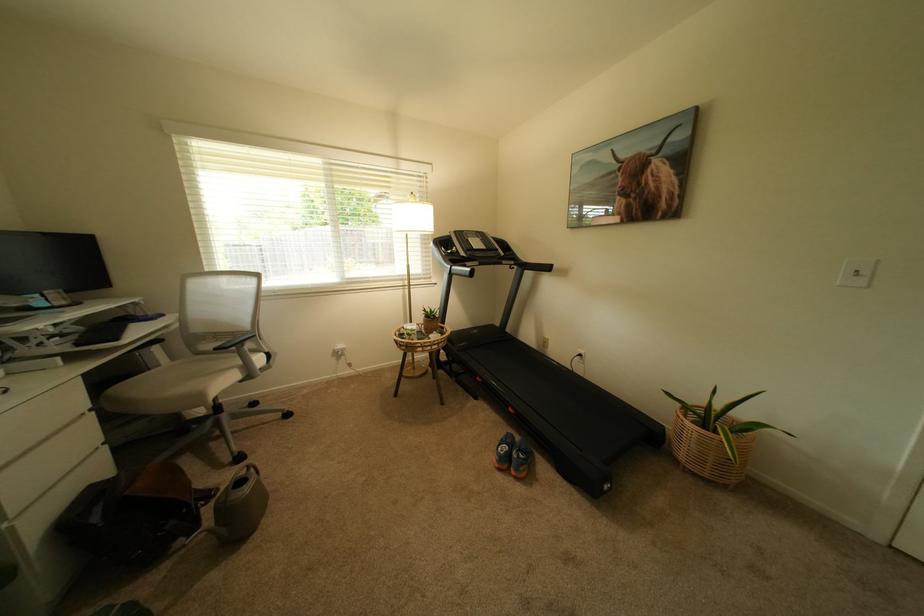
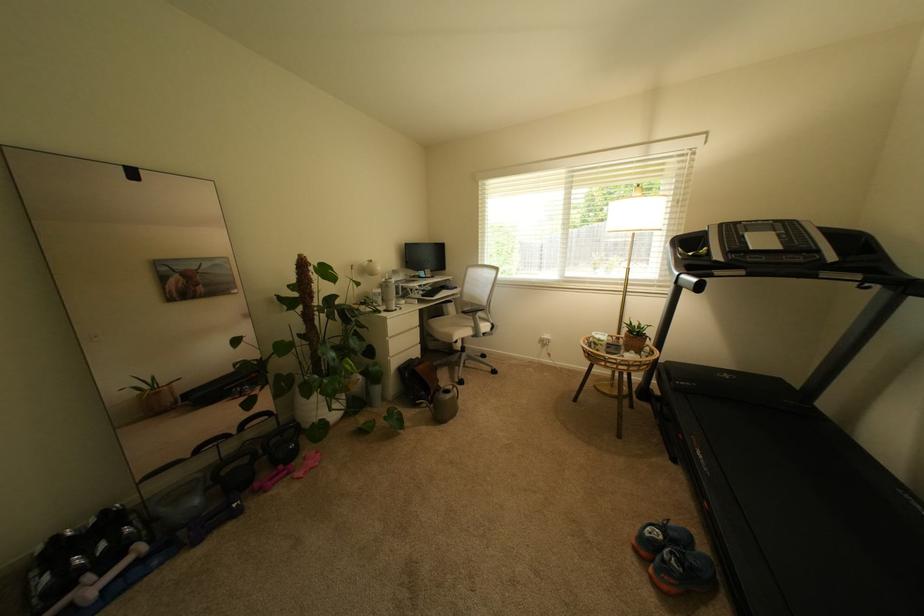
Find the pixel in the second image that matches [332,222] in the first image.

(608, 217)